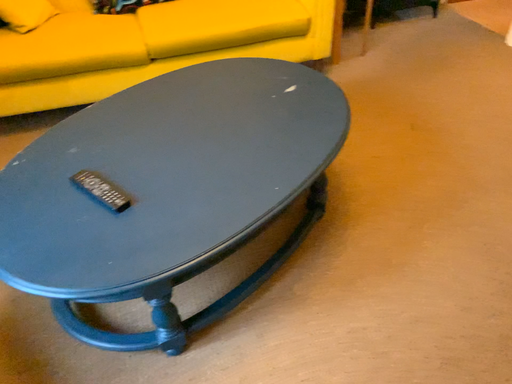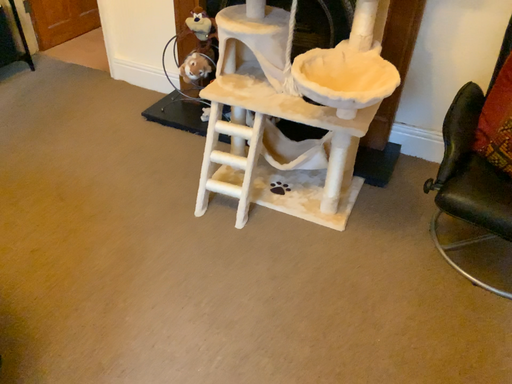
Question: How did the camera likely rotate when shooting the video?

Choices:
 (A) rotated right
 (B) rotated left

Answer: (A)